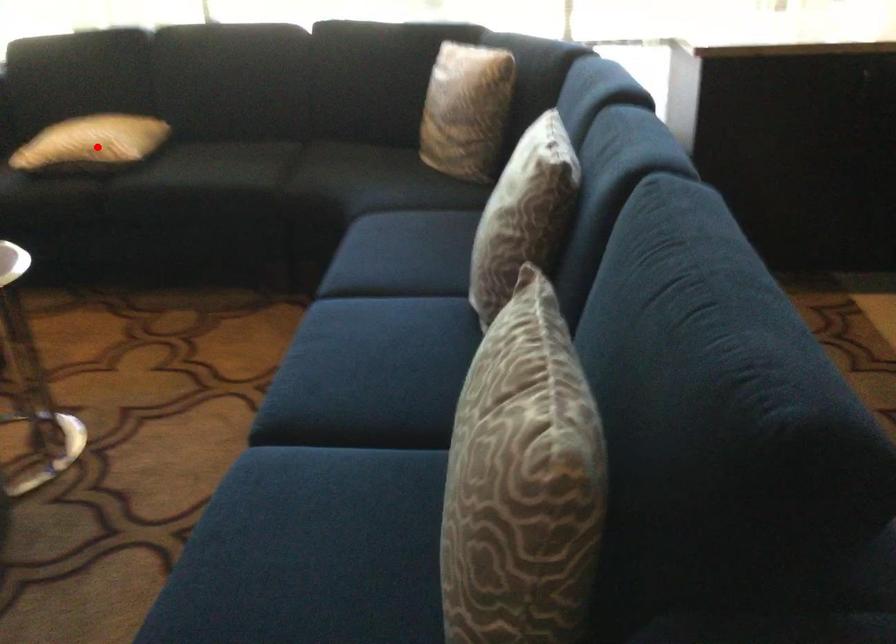
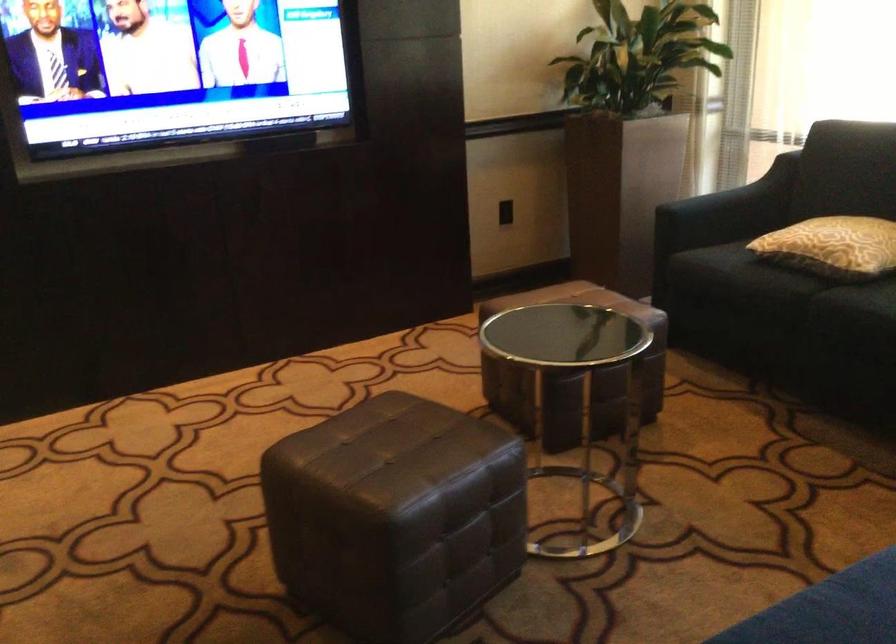
Question: I am providing you with two images of the same scene from different viewpoints. Image1 has a red point marked. In image2, the corresponding 3D location appears at what relative position? Reply with the corresponding letter.

Choices:
 (A) Closer
 (B) Farther

Answer: (A)